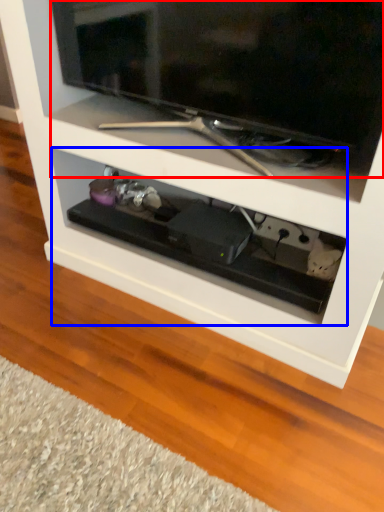
Question: Which object appears closest to the camera in this image, television (highlighted by a red box) or drawer (highlighted by a blue box)?

Choices:
 (A) television
 (B) drawer

Answer: (A)